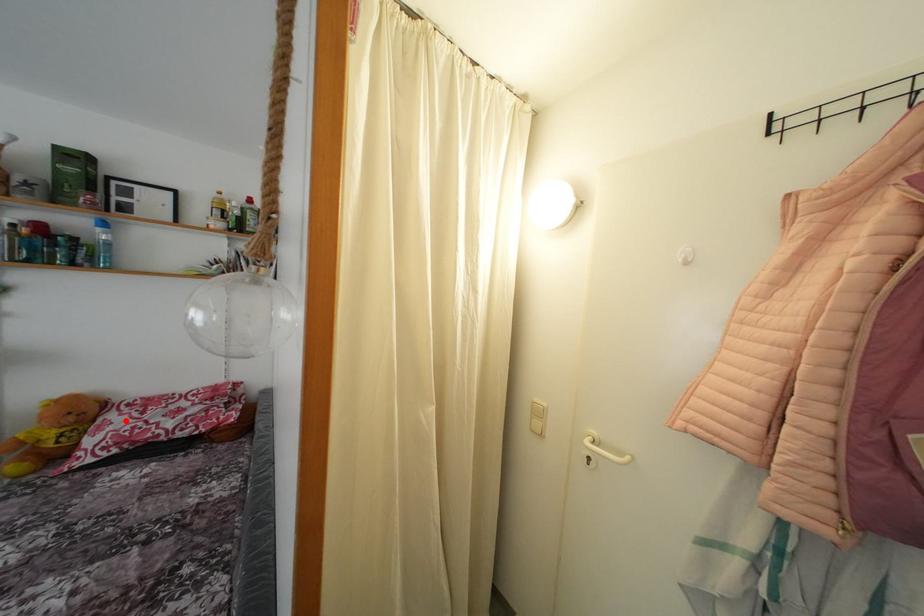
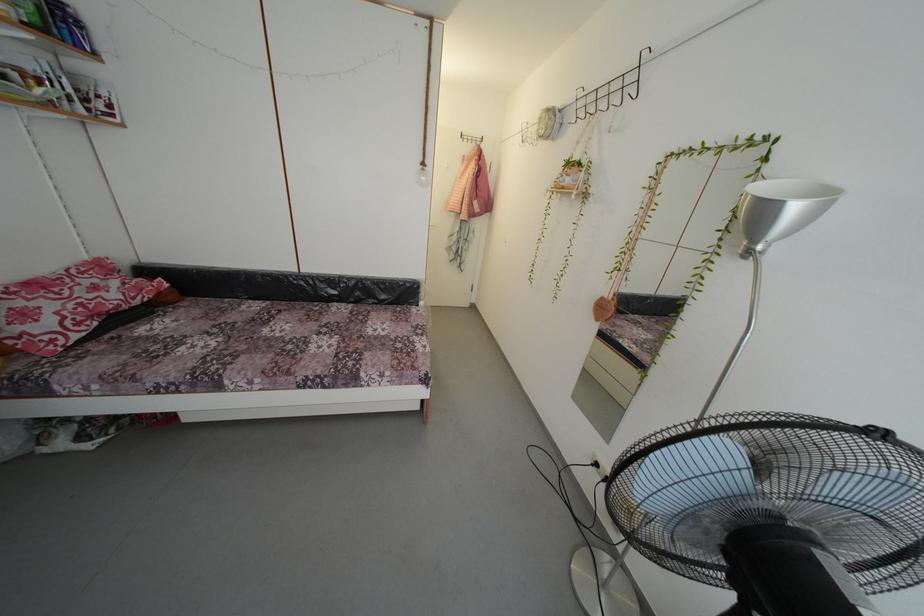
Question: I am providing you with two images of the same scene from different viewpoints. A red point is marked on the first image. Is the red point's position out of view in image 2?

Choices:
 (A) Yes
 (B) No

Answer: (B)